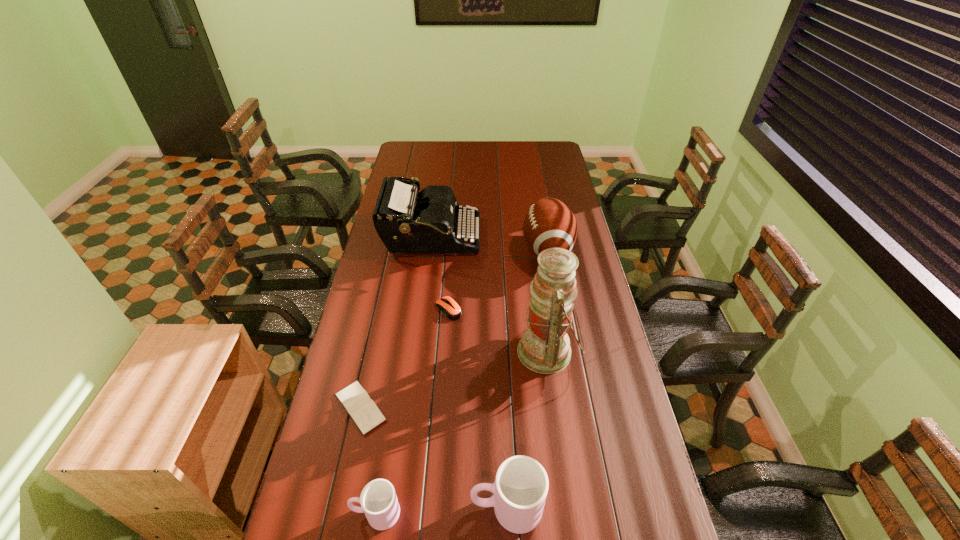
In order to click on free space located 0.090m with the handle on the side of the shorter cup in this screenshot , I will do `click(316, 513)`.

Where is `free point located 0.130m with the handle on the side of the fourth shortest object`? free point located 0.130m with the handle on the side of the fourth shortest object is located at coordinates (420, 508).

This screenshot has height=540, width=960. I want to click on blank area located 0.120m with the handle on the side of the fourth shortest object, so click(x=423, y=508).

Where is `free region located 0.100m with the handle on the side of the fourth shortest object`? free region located 0.100m with the handle on the side of the fourth shortest object is located at coordinates (431, 508).

This screenshot has width=960, height=540. Find the location of `vacant region located on the laces of the football`. vacant region located on the laces of the football is located at coordinates (442, 249).

Locate an element on the screen. This screenshot has width=960, height=540. vacant point located 0.050m on the laces of the football is located at coordinates (510, 249).

Where is `blank space located on the laces of the football`? Image resolution: width=960 pixels, height=540 pixels. blank space located on the laces of the football is located at coordinates (442, 249).

Locate an element on the screen. Image resolution: width=960 pixels, height=540 pixels. free region located on the back of the computer mouse is located at coordinates (453, 252).

Find the location of a particular element. The image size is (960, 540). free space located 0.220m on the front of the oil lamp is located at coordinates (562, 456).

In order to click on vacant space situated on the typing side of the typewriter in this screenshot , I will do `click(558, 237)`.